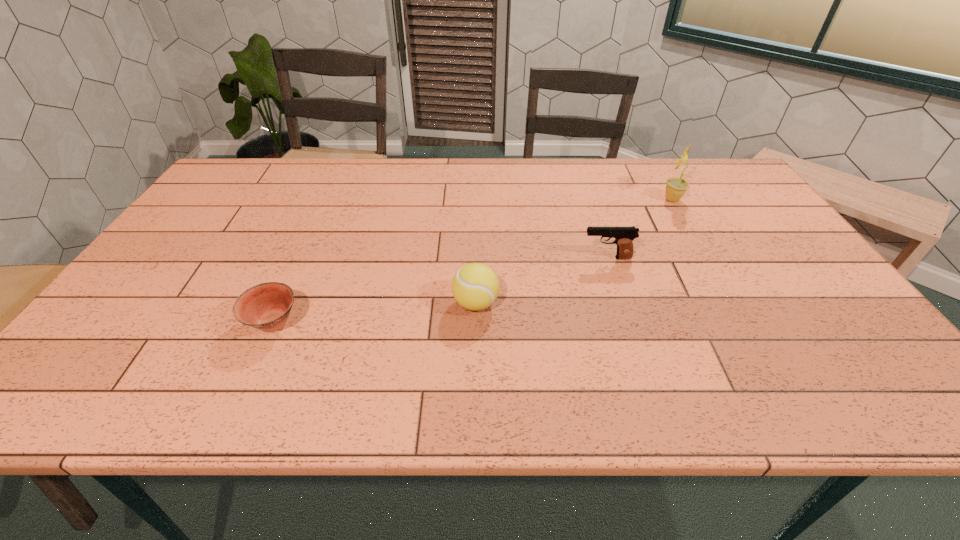
Identify the location of the rightmost object. The height and width of the screenshot is (540, 960). (676, 187).

Where is `sunflower`? This screenshot has height=540, width=960. sunflower is located at coordinates (676, 187).

At what (x,y) coordinates should I click in order to perform the action: click on tennis ball. Please return your answer as a coordinate pair (x, y). The height and width of the screenshot is (540, 960). Looking at the image, I should click on point(475,286).

Find the location of `pistol`. pistol is located at coordinates (624, 236).

Where is `the second farthest object`? the second farthest object is located at coordinates (624, 236).

Where is `the shortest object`? the shortest object is located at coordinates (266, 306).

Where is `bowl`? The height and width of the screenshot is (540, 960). bowl is located at coordinates (266, 306).

Image resolution: width=960 pixels, height=540 pixels. Find the location of `vacant point located 0.100m on the face of the rightmost object`. vacant point located 0.100m on the face of the rightmost object is located at coordinates (630, 199).

Find the location of a particular element. The image size is (960, 540). vacant space situated 0.320m on the face of the rightmost object is located at coordinates (561, 199).

You are a GUI agent. You are given a task and a screenshot of the screen. Output one action in this format:
    pyautogui.click(x=<x>, y=<y>)
    Task: Click on the free space located 0.210m on the face of the rightmost object
    The height and width of the screenshot is (540, 960).
    Given the screenshot: What is the action you would take?
    pyautogui.click(x=595, y=199)